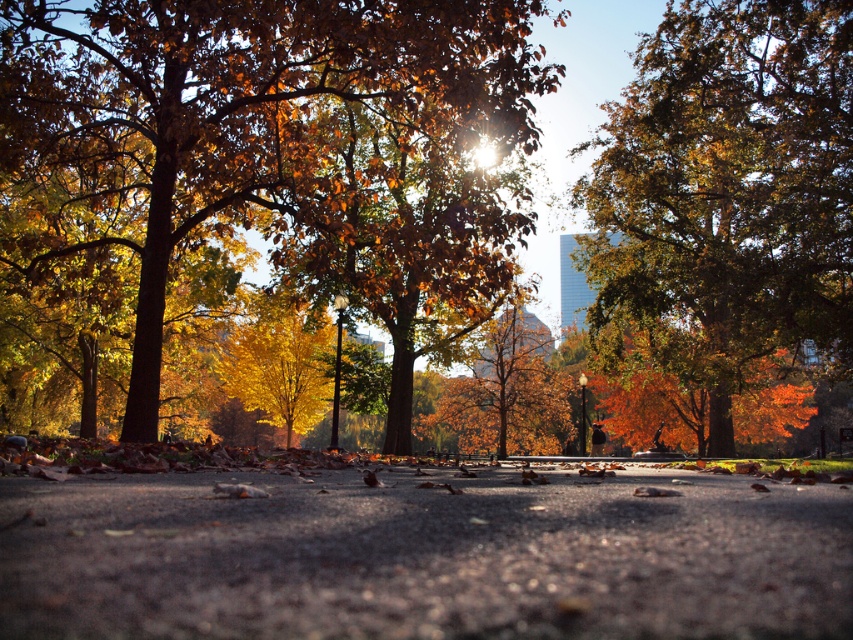
Question: Among these points, which one is farthest from the camera?

Choices:
 (A) (56, 228)
 (B) (639, 58)
 (C) (485, 412)

Answer: (C)

Question: Can you confirm if golden leaves at center is wider than golden textured leaves at center?

Choices:
 (A) no
 (B) yes

Answer: (B)

Question: Is golden leaves at center to the right of golden textured leaves at center from the viewer's perspective?

Choices:
 (A) no
 (B) yes

Answer: (A)

Question: Is golden leaves at center above golden textured tree at center?

Choices:
 (A) no
 (B) yes

Answer: (B)

Question: Which point appears farthest from the camera in this image?

Choices:
 (A) (834, 246)
 (B) (157, 205)

Answer: (A)

Question: Which of the following is the farthest from the observer?

Choices:
 (A) golden leaves at center
 (B) golden textured tree at center

Answer: (B)